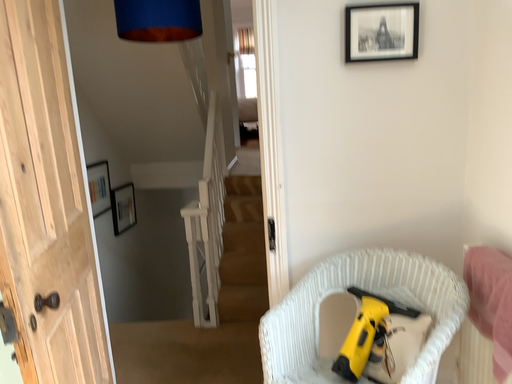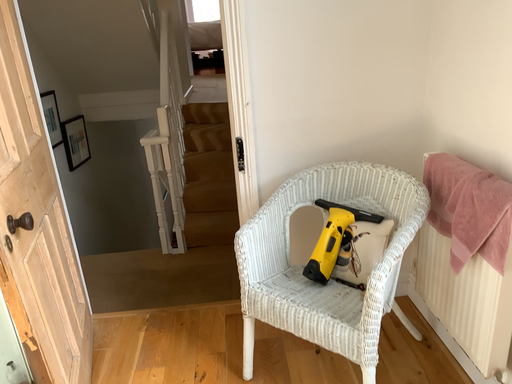
Question: How did the camera likely rotate when shooting the video?

Choices:
 (A) rotated downward
 (B) rotated upward

Answer: (A)